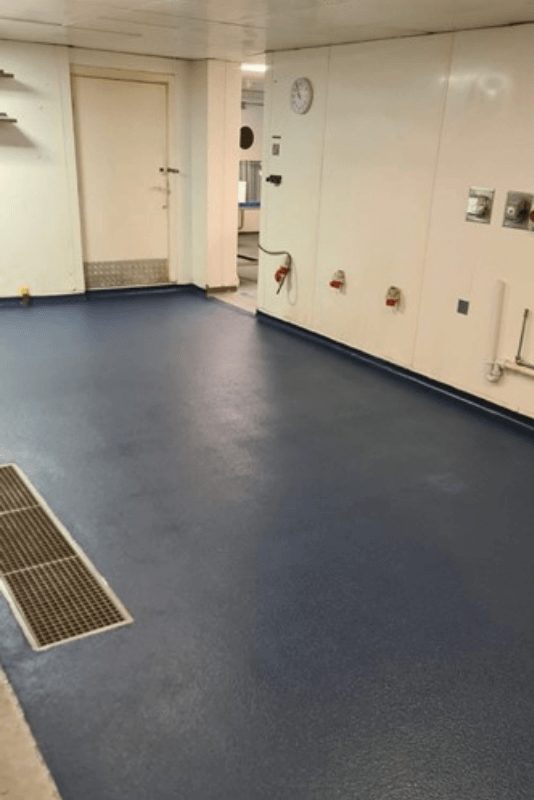
Image resolution: width=534 pixels, height=800 pixels. What are the coordinates of `vent` in the screenshot? It's located at (56, 586).